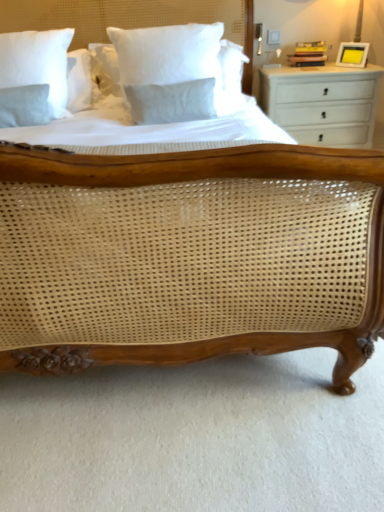
The image size is (384, 512). What do you see at coordinates (322, 103) in the screenshot?
I see `white painted wood chest of drawers at right` at bounding box center [322, 103].

What is the approximate width of white painted wood chest of drawers at right?

18.93 inches.

The height and width of the screenshot is (512, 384). What do you see at coordinates (352, 54) in the screenshot? I see `yellow matte picture frame at upper right` at bounding box center [352, 54].

What are the coordinates of `white painted wood chest of drawers at right` in the screenshot? It's located at (322, 103).

How many degrees apart are the facing directions of white cotton pillow at upper left, which ranks as the 2th pillow in front-to-back order, and yellow matte picture frame at upper right?

They differ by 48 degrees in their facing directions.

Considering the relative sizes of white cotton pillow at upper left, acting as the first pillow starting from the back, and yellow matte picture frame at upper right in the image provided, is white cotton pillow at upper left, acting as the first pillow starting from the back, wider than yellow matte picture frame at upper right?

Yes, white cotton pillow at upper left, acting as the first pillow starting from the back, is wider than yellow matte picture frame at upper right.

Between white cotton pillow at upper left, the second pillow in the right-to-left sequence, and yellow matte picture frame at upper right, which one has larger size?

Bigger between the two is white cotton pillow at upper left, the second pillow in the right-to-left sequence.

Is white cotton pillow at upper left, which ranks as the 2th pillow in front-to-back order, facing away from yellow matte picture frame at upper right?

white cotton pillow at upper left, which ranks as the 2th pillow in front-to-back order, does not have its back to yellow matte picture frame at upper right.

From a real-world perspective, is white cotton pillow at upper center, acting as the second pillow starting from the back, positioned above or below yellow matte picture frame at upper right?

white cotton pillow at upper center, acting as the second pillow starting from the back, is below yellow matte picture frame at upper right.

Is white cotton pillow at upper center, arranged as the 2th pillow when viewed from the left, wider or thinner than yellow matte picture frame at upper right?

white cotton pillow at upper center, arranged as the 2th pillow when viewed from the left, is wider than yellow matte picture frame at upper right.

From the image's perspective, between white cotton pillow at upper center, acting as the second pillow starting from the back, and yellow matte picture frame at upper right, which one is located above?

From the image's view, yellow matte picture frame at upper right is above.

Is white cotton pillow at upper center, arranged as the 2th pillow when viewed from the left, bigger than yellow matte picture frame at upper right?

Indeed, white cotton pillow at upper center, arranged as the 2th pillow when viewed from the left, has a larger size compared to yellow matte picture frame at upper right.

Considering the points (162, 62) and (13, 52), which point is in front, point (162, 62) or point (13, 52)?

The point (162, 62) is in front.

Can you confirm if white cotton pillow at upper center, acting as the second pillow starting from the back, is wider than white cotton pillow at upper left, acting as the first pillow starting from the back?

No, white cotton pillow at upper center, acting as the second pillow starting from the back, is not wider than white cotton pillow at upper left, acting as the first pillow starting from the back.

Can you see white cotton pillow at upper center, acting as the first pillow starting from the right, touching white cotton pillow at upper left, the second pillow in the right-to-left sequence?

There is a gap between white cotton pillow at upper center, acting as the first pillow starting from the right, and white cotton pillow at upper left, the second pillow in the right-to-left sequence.

From the image's perspective, would you say white cotton pillow at upper center, acting as the second pillow starting from the back, is shown under white cotton pillow at upper left, which ranks as the 2th pillow in front-to-back order?

Correct, white cotton pillow at upper center, acting as the second pillow starting from the back, appears lower than white cotton pillow at upper left, which ranks as the 2th pillow in front-to-back order, in the image.

Between yellow matte picture frame at upper right and white cotton pillow at upper left, the second pillow in the right-to-left sequence, which one appears on the left side from the viewer's perspective?

white cotton pillow at upper left, the second pillow in the right-to-left sequence, is more to the left.

This screenshot has width=384, height=512. Find the location of `the 2nd pillow to the left of the yellow matte picture frame at upper right, starting your count from the anchor`. the 2nd pillow to the left of the yellow matte picture frame at upper right, starting your count from the anchor is located at coordinates (37, 63).

Is white cotton pillow at upper left, acting as the first pillow starting from the left, a part of yellow matte picture frame at upper right?

Actually, white cotton pillow at upper left, acting as the first pillow starting from the left, is outside yellow matte picture frame at upper right.

Looking at this image, which point is more forward, (46, 37) or (196, 29)?

The point (196, 29) is closer to the camera.

Is white cotton pillow at upper left, which ranks as the 2th pillow in front-to-back order, positioned with its back to white cotton pillow at upper center, arranged as the 2th pillow when viewed from the left?

No, white cotton pillow at upper left, which ranks as the 2th pillow in front-to-back order,'s orientation is not away from white cotton pillow at upper center, arranged as the 2th pillow when viewed from the left.

How different are the orientations of white cotton pillow at upper left, the second pillow in the right-to-left sequence, and white cotton pillow at upper center, acting as the first pillow starting from the right, in degrees?

The angle between the facing direction of white cotton pillow at upper left, the second pillow in the right-to-left sequence, and the facing direction of white cotton pillow at upper center, acting as the first pillow starting from the right, is 2.98 degrees.

From the picture: Can you confirm if white cotton pillow at upper left, acting as the first pillow starting from the left, is thinner than white cotton pillow at upper center, arranged as the 2th pillow when viewed from the left?

Incorrect, the width of white cotton pillow at upper left, acting as the first pillow starting from the left, is not less than that of white cotton pillow at upper center, arranged as the 2th pillow when viewed from the left.

From the picture: From a real-world perspective, which is physically above, white cotton pillow at upper left, acting as the first pillow starting from the back, or white painted wood chest of drawers at right?

white cotton pillow at upper left, acting as the first pillow starting from the back, is physically above.

Do you think white cotton pillow at upper left, acting as the first pillow starting from the back, is within white painted wood chest of drawers at right, or outside of it?

white cotton pillow at upper left, acting as the first pillow starting from the back, cannot be found inside white painted wood chest of drawers at right.

Can you confirm if white cotton pillow at upper left, acting as the first pillow starting from the left, is shorter than white painted wood chest of drawers at right?

Yes.

Locate an element on the screen. pillow that is the 2nd one when counting leftward from the white painted wood chest of drawers at right is located at coordinates (37, 63).

Are yellow matte picture frame at upper right and white painted wood chest of drawers at right located far from each other?

No.

Could you measure the distance between yellow matte picture frame at upper right and white painted wood chest of drawers at right?

The distance of yellow matte picture frame at upper right from white painted wood chest of drawers at right is 11.21 inches.

Based on their sizes in the image, would you say yellow matte picture frame at upper right is bigger or smaller than white painted wood chest of drawers at right?

In the image, yellow matte picture frame at upper right appears to be smaller than white painted wood chest of drawers at right.

From a real-world perspective, is yellow matte picture frame at upper right over white painted wood chest of drawers at right?

Yes, from a real-world perspective, yellow matte picture frame at upper right is over white painted wood chest of drawers at right

I want to click on picture frame above the white cotton pillow at upper left, which ranks as the 2th pillow in front-to-back order (from the image's perspective), so click(x=352, y=54).

The height and width of the screenshot is (512, 384). In order to click on pillow that is the 2nd one when counting forward from the yellow matte picture frame at upper right in this screenshot , I will do `click(169, 71)`.

Considering their positions, is white cotton pillow at upper center, arranged as the 2th pillow when viewed from the left, positioned closer to white painted wood chest of drawers at right than yellow matte picture frame at upper right?

yellow matte picture frame at upper right lies closer to white painted wood chest of drawers at right than the other object.

From the image, which object appears to be farther from white cotton pillow at upper center, acting as the first pillow starting from the right, white painted wood chest of drawers at right or yellow matte picture frame at upper right?

The object further to white cotton pillow at upper center, acting as the first pillow starting from the right, is yellow matte picture frame at upper right.

Estimate the real-world distances between objects in this image. Which object is further from white cotton pillow at upper left, the second pillow in the right-to-left sequence, white cotton pillow at upper center, the first pillow when ordered from front to back, or white painted wood chest of drawers at right?

white painted wood chest of drawers at right is further to white cotton pillow at upper left, the second pillow in the right-to-left sequence.

Which object lies nearer to the anchor point white cotton pillow at upper left, which ranks as the 2th pillow in front-to-back order, white painted wood chest of drawers at right or yellow matte picture frame at upper right?

white painted wood chest of drawers at right is closer to white cotton pillow at upper left, which ranks as the 2th pillow in front-to-back order.

Considering their positions, is white cotton pillow at upper center, acting as the first pillow starting from the right, positioned further to white painted wood chest of drawers at right than white cotton pillow at upper left, which ranks as the 2th pillow in front-to-back order?

Based on the image, white cotton pillow at upper left, which ranks as the 2th pillow in front-to-back order, appears to be further to white painted wood chest of drawers at right.

From the image, which object appears to be farther from white cotton pillow at upper left, acting as the first pillow starting from the back, white painted wood chest of drawers at right or white cotton pillow at upper center, the first pillow when ordered from front to back?

white painted wood chest of drawers at right.

From the picture: Looking at the image, which one is located closer to white painted wood chest of drawers at right, yellow matte picture frame at upper right or white cotton pillow at upper left, acting as the first pillow starting from the back?

Among the two, yellow matte picture frame at upper right is located nearer to white painted wood chest of drawers at right.

Considering their positions, is yellow matte picture frame at upper right positioned closer to white cotton pillow at upper center, the first pillow when ordered from front to back, than white cotton pillow at upper left, acting as the first pillow starting from the back?

Among the two, white cotton pillow at upper left, acting as the first pillow starting from the back, is located nearer to white cotton pillow at upper center, the first pillow when ordered from front to back.

Image resolution: width=384 pixels, height=512 pixels. I want to click on chest of drawers between white cotton pillow at upper left, which ranks as the 2th pillow in front-to-back order, and yellow matte picture frame at upper right from left to right, so click(322, 103).

The image size is (384, 512). What are the coordinates of `pillow between white cotton pillow at upper left, acting as the first pillow starting from the back, and yellow matte picture frame at upper right, in the horizontal direction` in the screenshot? It's located at point(169,71).

Find the location of a particular element. This screenshot has width=384, height=512. pillow between white cotton pillow at upper left, acting as the first pillow starting from the back, and white painted wood chest of drawers at right from left to right is located at coordinates (169, 71).

Image resolution: width=384 pixels, height=512 pixels. I want to click on chest of drawers between white cotton pillow at upper center, arranged as the 2th pillow when viewed from the left, and yellow matte picture frame at upper right, in the horizontal direction, so click(x=322, y=103).